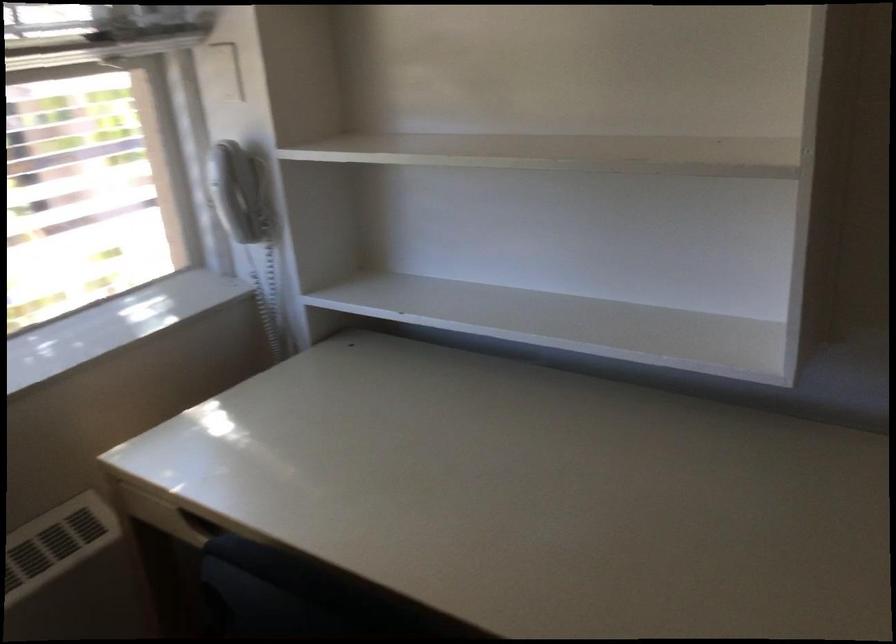
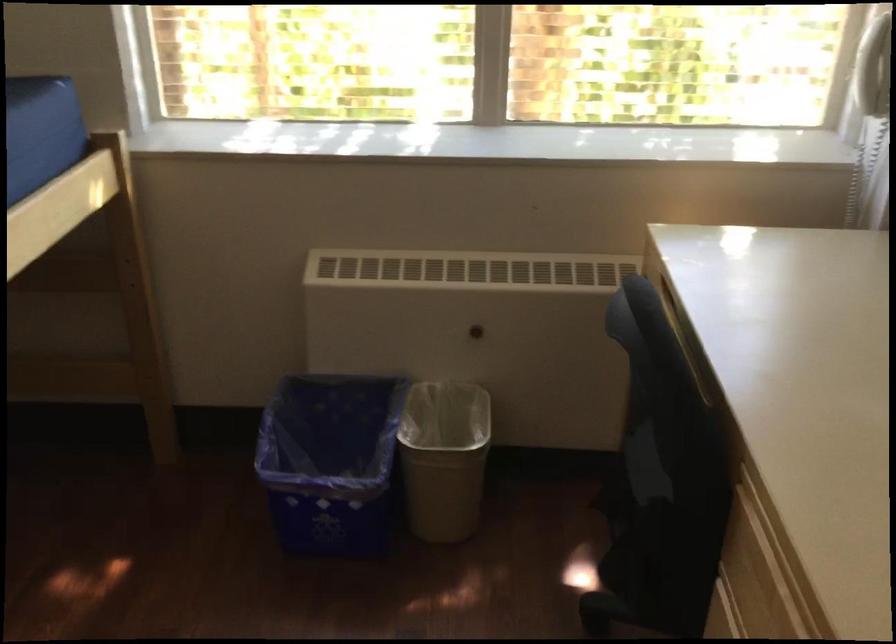
From the picture: The images are taken continuously from a first-person perspective. In which direction is your viewpoint rotating?

The camera's rotation is toward left-down.